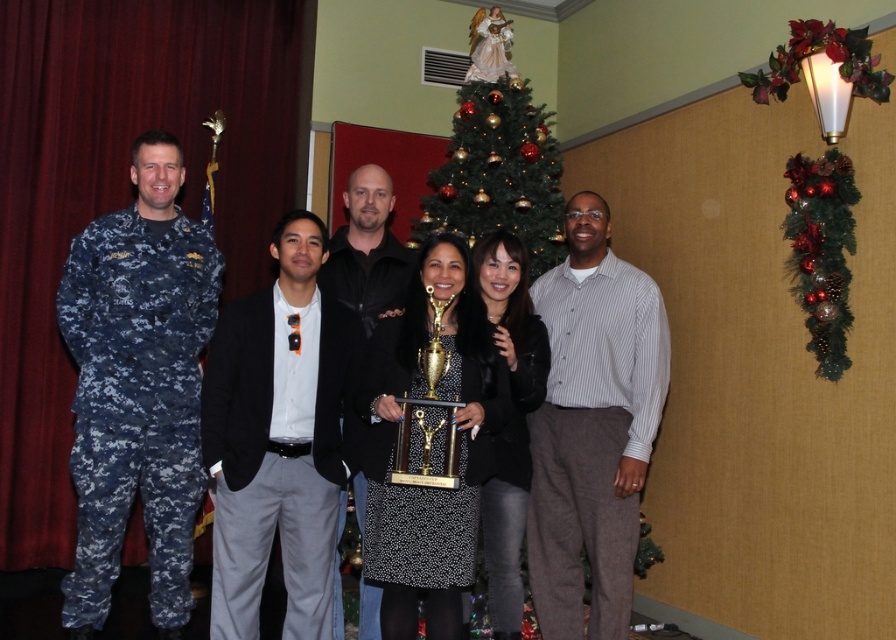
Can you confirm if digital camouflage uniform at left is thinner than striped button-up shirt at center?

No, digital camouflage uniform at left is not thinner than striped button-up shirt at center.

In the scene shown: Who is more forward, (128, 275) or (532, 465)?

Point (128, 275) is in front.

Which is in front, point (174, 461) or point (553, 355)?

Point (174, 461)

Image resolution: width=896 pixels, height=640 pixels. What are the coordinates of `digital camouflage uniform at left` in the screenshot? It's located at (136, 401).

I want to click on digital camouflage uniform at left, so click(136, 401).

Which is more to the left, green textured garland at upper right or black leather jacket at center?

black leather jacket at center is more to the left.

Does green textured garland at upper right have a smaller size compared to black leather jacket at center?

Yes, green textured garland at upper right is smaller than black leather jacket at center.

Is point (800, 161) positioned before point (341, 532)?

Yes.

Locate an element on the screen. The height and width of the screenshot is (640, 896). green textured garland at upper right is located at coordinates (821, 252).